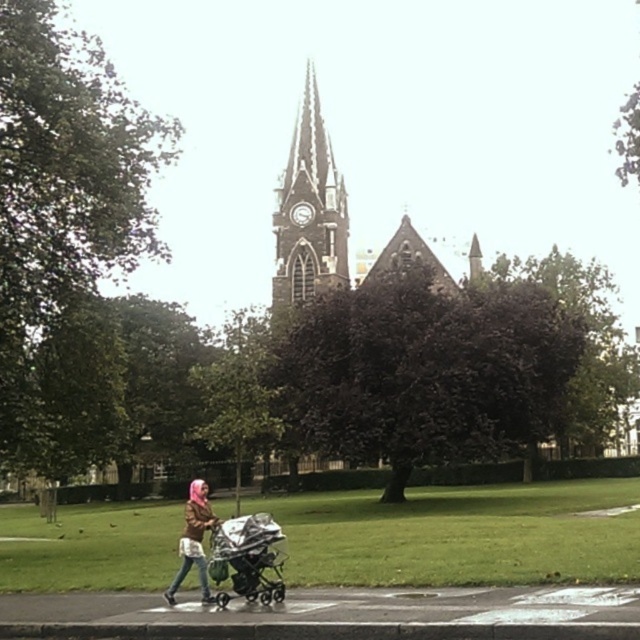
You are a photographer planning to capture the dark brown stone clock tower at center and the pink fabric baby stroller at lower center in a single frame. Given that the stroller is closer to you than the tower, which object will appear larger in the photo?

The dark brown stone clock tower at center will appear larger in the photo because its actual width is greater than the pink fabric baby stroller at lower center, even though the stroller is closer to the photographer.

You are a parent pushing the metallic silver stroller at center and need to reach the nearby playground located 10 meters away from the pink fabric baby stroller at lower center. Can you safely navigate the path between the two strollers and reach the playground within 15 meters?

The distance between the metallic silver stroller at center and the pink fabric baby stroller at lower center is 4.50 meters. Since the playground is 10 meters away from the pink fabric baby stroller at lower center, the total distance from the metallic silver stroller to the playground would be 4.50 meters plus 10 meters, totaling 14.5 meters. This is within the 15 meters limit, so yes, you can safely navigate the path and reach the playground within the required distance.

You are a photographer standing at the edge of the paved area. You want to capture a photo of the dark brown stone clock tower at center without the metallic silver stroller at center blocking the view. Is the stroller currently in the way of the tower in the photo?

The dark brown stone clock tower at center is above the metallic silver stroller at center, so the stroller is positioned lower and would not block the view of the tower in the photo.